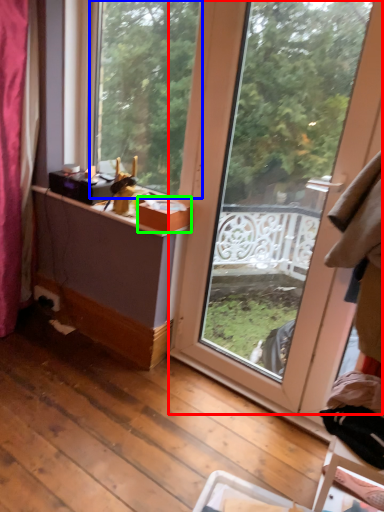
Question: Estimate the real-world distances between objects in this image. Which object is closer to window (highlighted by a red box), window (highlighted by a blue box) or box (highlighted by a green box)?

Choices:
 (A) window
 (B) box

Answer: (B)